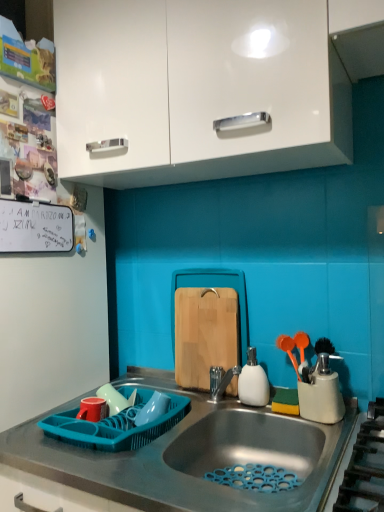
Measure the distance between white glossy cabinet at upper center and camera.

white glossy cabinet at upper center is 34.90 inches from camera.

What do you see at coordinates (253, 382) in the screenshot? This screenshot has height=512, width=384. I see `white matte soap dispenser at sink, which ranks as the first appliance in right-to-left order` at bounding box center [253, 382].

The width and height of the screenshot is (384, 512). What are the coordinates of `gray matte countertop at center` in the screenshot? It's located at (193, 460).

Locate an element on the screen. Image resolution: width=384 pixels, height=512 pixels. white magnetic at left is located at coordinates (35, 227).

From a real-world perspective, starting from the white glossy cabinet at upper center, which appliance is the 1st one below it? Please provide its 2D coordinates.

[(253, 382)]

From a real-world perspective, is white matte soap dispenser at sink, which is counted as the first appliance, starting from the top, beneath white glossy cabinet at upper center?

Yes.

What's the angular difference between white matte soap dispenser at sink, which is the 2th appliance in left-to-right order, and white glossy cabinet at upper center's facing directions?

There is a 3.05-degree angle between the facing directions of white matte soap dispenser at sink, which is the 2th appliance in left-to-right order, and white glossy cabinet at upper center.

Considering the relative sizes of white matte soap dispenser at sink, which is the 2th appliance in left-to-right order, and white glossy cabinet at upper center in the image provided, is white matte soap dispenser at sink, which is the 2th appliance in left-to-right order, bigger than white glossy cabinet at upper center?

Incorrect, white matte soap dispenser at sink, which is the 2th appliance in left-to-right order, is not larger than white glossy cabinet at upper center.

Are natural wood cutting board at center and white glossy cabinet at upper center located far from each other?

natural wood cutting board at center is actually quite close to white glossy cabinet at upper center.

Considering the sizes of objects natural wood cutting board at center and white glossy cabinet at upper center in the image provided, who is bigger, natural wood cutting board at center or white glossy cabinet at upper center?

white glossy cabinet at upper center.

How far apart are natural wood cutting board at center and white glossy cabinet at upper center?

A distance of 62.10 centimeters exists between natural wood cutting board at center and white glossy cabinet at upper center.

Is point (235, 393) behind point (71, 125)?

Yes, point (235, 393) is farther from viewer.

Locate an element on the screen. The height and width of the screenshot is (512, 384). appliance on the right of the white glossy cabinet at upper center is located at coordinates (253, 382).

Which is more to the right, white glossy cabinet at upper center or white matte soap dispenser at sink, which ranks as the first appliance in right-to-left order?

white matte soap dispenser at sink, which ranks as the first appliance in right-to-left order.

From a real-world perspective, which is physically above, white glossy cabinet at upper center or white matte soap dispenser at sink, which ranks as the first appliance in right-to-left order?

white glossy cabinet at upper center, from a real-world perspective.

From a real-world perspective, is white matte soap dispenser at sink, which is the 2th appliance in left-to-right order, positioned above or below gray matte countertop at center?

white matte soap dispenser at sink, which is the 2th appliance in left-to-right order, is situated higher than gray matte countertop at center in the real world.

Is white matte soap dispenser at sink, which is counted as the first appliance, starting from the top, oriented towards gray matte countertop at center?

No.

Is point (261, 401) closer to camera compared to point (110, 509)?

No, (261, 401) is further to viewer.

From the image's perspective, is white matte soap dispenser at sink, which is counted as the first appliance, starting from the top, over gray matte countertop at center?

Indeed, from the image's perspective, white matte soap dispenser at sink, which is counted as the first appliance, starting from the top, is shown above gray matte countertop at center.

How much distance is there between white glossy cabinet at upper center and teal plastic dish rack at lower left, acting as the 1th appliance starting from the left?

A distance of 32.64 inches exists between white glossy cabinet at upper center and teal plastic dish rack at lower left, acting as the 1th appliance starting from the left.

Is white glossy cabinet at upper center not close to teal plastic dish rack at lower left, positioned as the 2th appliance in top-to-bottom order?

No, white glossy cabinet at upper center is in close proximity to teal plastic dish rack at lower left, positioned as the 2th appliance in top-to-bottom order.

Consider the image. Who is bigger, white glossy cabinet at upper center or teal plastic dish rack at lower left, placed as the 2th appliance when sorted from right to left?

Bigger between the two is white glossy cabinet at upper center.

Is white glossy cabinet at upper center to the left of teal plastic dish rack at lower left, placed as the 2th appliance when sorted from right to left, from the viewer's perspective?

No, white glossy cabinet at upper center is not to the left of teal plastic dish rack at lower left, placed as the 2th appliance when sorted from right to left.

In the scene shown: Does white magnetic at left touch natural wood cutting board at center?

white magnetic at left and natural wood cutting board at center are not in contact.

Based on the photo, can you confirm if white magnetic at left is wider than natural wood cutting board at center?

Incorrect, the width of white magnetic at left does not surpass that of natural wood cutting board at center.

In the scene shown: Which is farther from the camera, (31, 202) or (178, 329)?

The point (178, 329) is farther.

From the image's perspective, between white magnetic at left and natural wood cutting board at center, which one is located above?

white magnetic at left, from the image's perspective.

Is natural wood cutting board at center with teal plastic dish rack at lower left, positioned as the 2th appliance in top-to-bottom order?

No.

Considering the positions of point (199, 288) and point (122, 437), is point (199, 288) closer or farther from the camera than point (122, 437)?

Point (199, 288).

Image resolution: width=384 pixels, height=512 pixels. I want to click on cutting board on the right of teal plastic dish rack at lower left, positioned as the 2th appliance in top-to-bottom order, so click(205, 334).

Is natural wood cutting board at center thinner than teal plastic dish rack at lower left, placed as the 2th appliance when sorted from right to left?

Yes, natural wood cutting board at center is thinner than teal plastic dish rack at lower left, placed as the 2th appliance when sorted from right to left.

What are the coordinates of `cabinetry on the left side of white matte soap dispenser at sink, which is the 2th appliance in left-to-right order` in the screenshot? It's located at (196, 89).

Where is `cutting board below the white glossy cabinet at upper center (from the image's perspective)`? This screenshot has height=512, width=384. cutting board below the white glossy cabinet at upper center (from the image's perspective) is located at coordinates (205, 334).

Looking at the image, which one is located further to white magnetic at left, white glossy cabinet at upper center or natural wood cutting board at center?

Based on the image, natural wood cutting board at center appears to be further to white magnetic at left.

Considering their positions, is white matte soap dispenser at sink, which ranks as the first appliance in right-to-left order, positioned closer to white glossy cabinet at upper center than white magnetic at left?

white magnetic at left lies closer to white glossy cabinet at upper center than the other object.

When comparing their distances from white magnetic at left, does white glossy cabinet at upper center or white matte soap dispenser at sink, which is counted as the first appliance, starting from the top, seem further?

white matte soap dispenser at sink, which is counted as the first appliance, starting from the top, is further to white magnetic at left.

Considering their positions, is white glossy cabinet at upper center positioned closer to natural wood cutting board at center than teal plastic dish rack at lower left, placed as the 2th appliance when sorted from right to left?

Among the two, teal plastic dish rack at lower left, placed as the 2th appliance when sorted from right to left, is located nearer to natural wood cutting board at center.

Estimate the real-world distances between objects in this image. Which object is further from natural wood cutting board at center, white glossy cabinet at upper center or gray matte countertop at center?

white glossy cabinet at upper center lies further to natural wood cutting board at center than the other object.

Which object lies further to the anchor point gray matte countertop at center, white glossy cabinet at upper center or natural wood cutting board at center?

Based on the image, white glossy cabinet at upper center appears to be further to gray matte countertop at center.

Considering their positions, is gray matte countertop at center positioned further to teal plastic dish rack at lower left, positioned as the 2th appliance in top-to-bottom order, than white matte soap dispenser at sink, which ranks as the first appliance in right-to-left order?

Based on the image, white matte soap dispenser at sink, which ranks as the first appliance in right-to-left order, appears to be further to teal plastic dish rack at lower left, positioned as the 2th appliance in top-to-bottom order.

Estimate the real-world distances between objects in this image. Which object is closer to natural wood cutting board at center, white magnetic at left or gray matte countertop at center?

Based on the image, gray matte countertop at center appears to be nearer to natural wood cutting board at center.

Locate an element on the screen. The height and width of the screenshot is (512, 384). cutting board between white magnetic at left and teal plastic dish rack at lower left, positioned as the 2th appliance in top-to-bottom order, in the up-down direction is located at coordinates (205, 334).

Find the location of a particular element. The width and height of the screenshot is (384, 512). appliance between white glossy cabinet at upper center and teal plastic dish rack at lower left, positioned as the 2th appliance in top-to-bottom order, in the vertical direction is located at coordinates (253, 382).

Where is `cutting board between white glossy cabinet at upper center and gray matte countertop at center from top to bottom`? The height and width of the screenshot is (512, 384). cutting board between white glossy cabinet at upper center and gray matte countertop at center from top to bottom is located at coordinates (205, 334).

The width and height of the screenshot is (384, 512). I want to click on bulletin board that lies between white glossy cabinet at upper center and white matte soap dispenser at sink, arranged as the second appliance when ordered from the bottom, from top to bottom, so pyautogui.click(x=35, y=227).